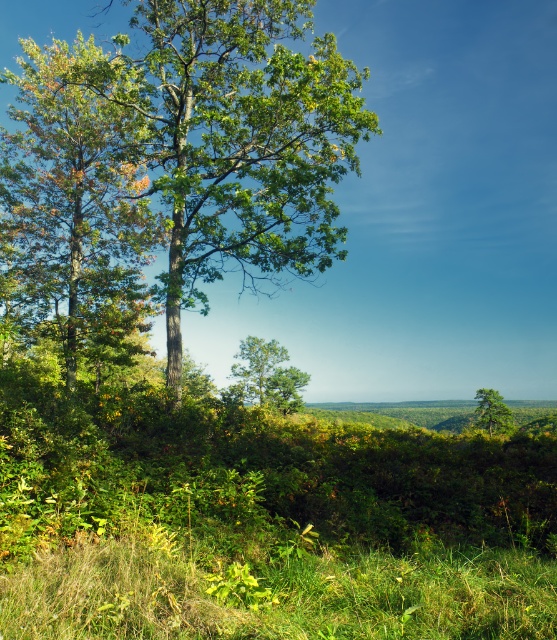
Consider the image. Who is positioned more to the left, green leafy tree at center or green matte tree at right?

From the viewer's perspective, green leafy tree at center appears more on the left side.

Is the position of green leafy tree at center more distant than that of green matte tree at right?

No, it is in front of green matte tree at right.

Where is `green leafy tree at center`? green leafy tree at center is located at coordinates (236, 140).

Is green leafy tree at left shorter than green matte tree at right?

In fact, green leafy tree at left may be taller than green matte tree at right.

Consider the image. Is the position of green leafy tree at left less distant than that of green matte tree at right?

Yes, green leafy tree at left is in front of green matte tree at right.

This screenshot has height=640, width=557. What do you see at coordinates (75, 205) in the screenshot? I see `green leafy tree at left` at bounding box center [75, 205].

Image resolution: width=557 pixels, height=640 pixels. In order to click on green leafy tree at left in this screenshot , I will do `click(75, 205)`.

Which is above, green leafy tree at center or green matte tree at center?

Positioned higher is green leafy tree at center.

Does green leafy tree at center have a lesser height compared to green matte tree at center?

No.

Does point (212, 122) lie in front of point (296, 378)?

Yes.

You are a GUI agent. You are given a task and a screenshot of the screen. Output one action in this format:
    pyautogui.click(x=<x>, y=<y>)
    Task: Click on the green leafy tree at center
    Image resolution: width=557 pixels, height=640 pixels.
    Given the screenshot: What is the action you would take?
    pyautogui.click(x=236, y=140)